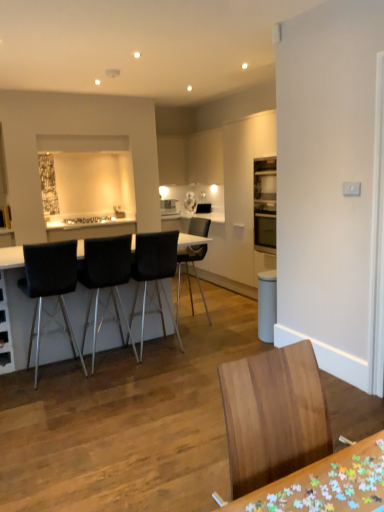
Locate an element on the screen. The image size is (384, 512). vacant region in front of black leather chair at left, the 4th chair in the back-to-front sequence is located at coordinates (60, 397).